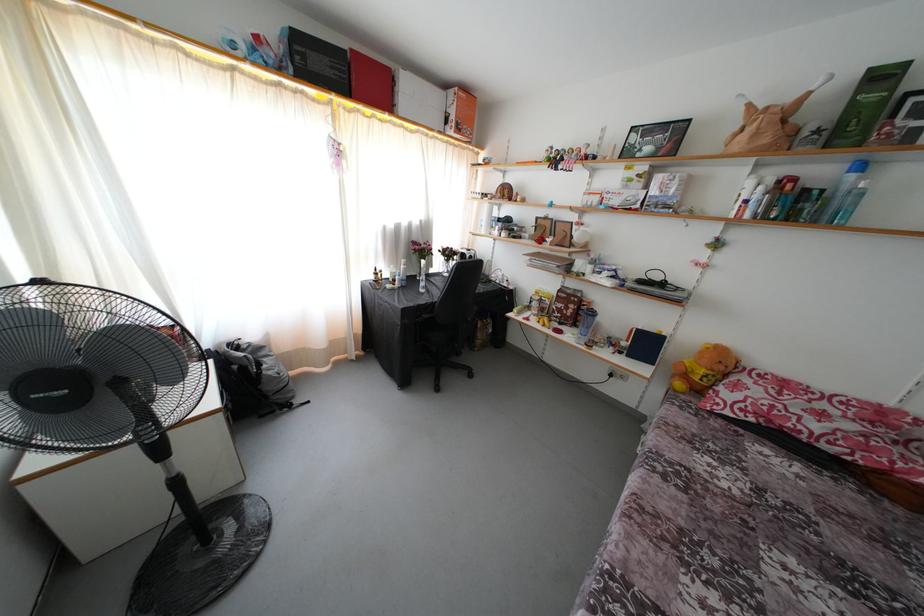
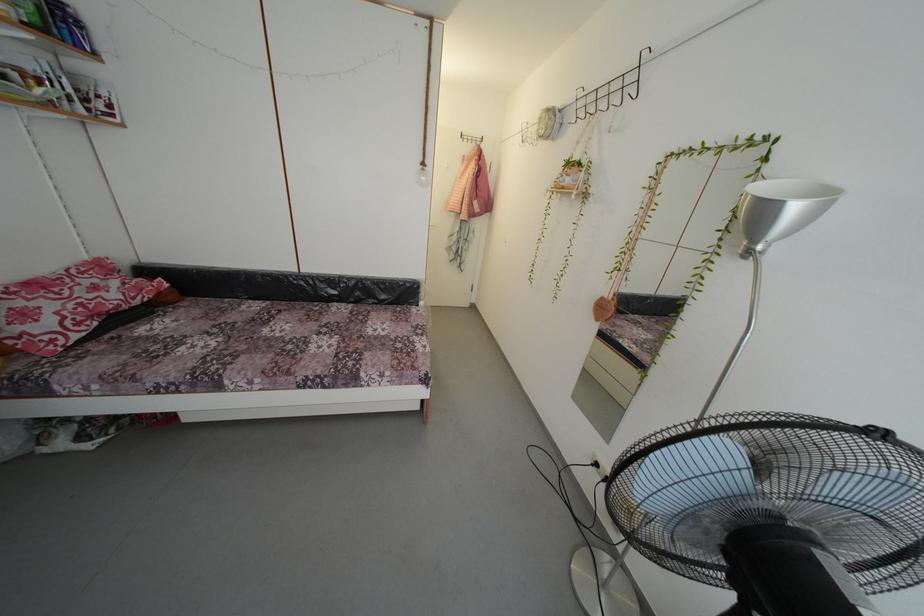
Locate, in the second image, the point that corresponds to point 742,498 in the first image.

(225, 345)